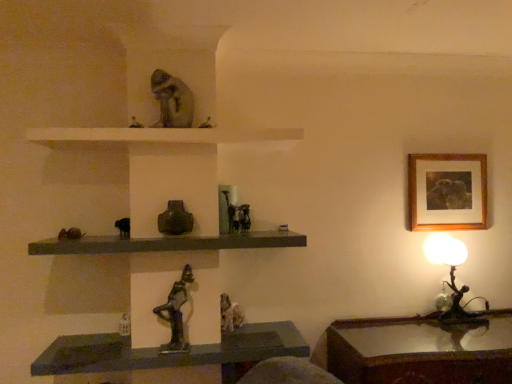
Question: Looking at the image, does white matte shelf at upper center, the first shelf in the top-to-bottom sequence, seem bigger or smaller compared to matte stone chameleon at upper center, which appears as the 4th animal when ordered from the bottom?

Choices:
 (A) big
 (B) small

Answer: (A)

Question: In the image, is white matte shelf at upper center, the second shelf from the bottom, positioned in front of or behind matte stone chameleon at upper center, which appears as the 4th animal when ordered from the bottom?

Choices:
 (A) behind
 (B) front

Answer: (B)

Question: Which of these objects is positioned closest to the green glass vase at center?

Choices:
 (A) wooden table at lower right
 (B) metallic statue at center, positioned as the third animal in bottom-to-top order
 (C) matte stone chameleon at upper center, which appears as the 4th animal when ordered from the bottom
 (D) metallic bronze figurine at right
 (E) white matte shelf at upper center, the first shelf in the top-to-bottom sequence

Answer: (B)

Question: Which of these objects is positioned farthest from the matte dark gray shelf at center, which is counted as the first shelf, starting from the bottom?

Choices:
 (A) bronze statue at center, which is the 2th animal from bottom to top
 (B) green glass vase at center
 (C) matte stone chameleon at upper center, which appears as the 4th animal when ordered from the bottom
 (D) metallic bronze figurine at right
 (E) white matte shelf at upper center, the second shelf from the bottom

Answer: (D)